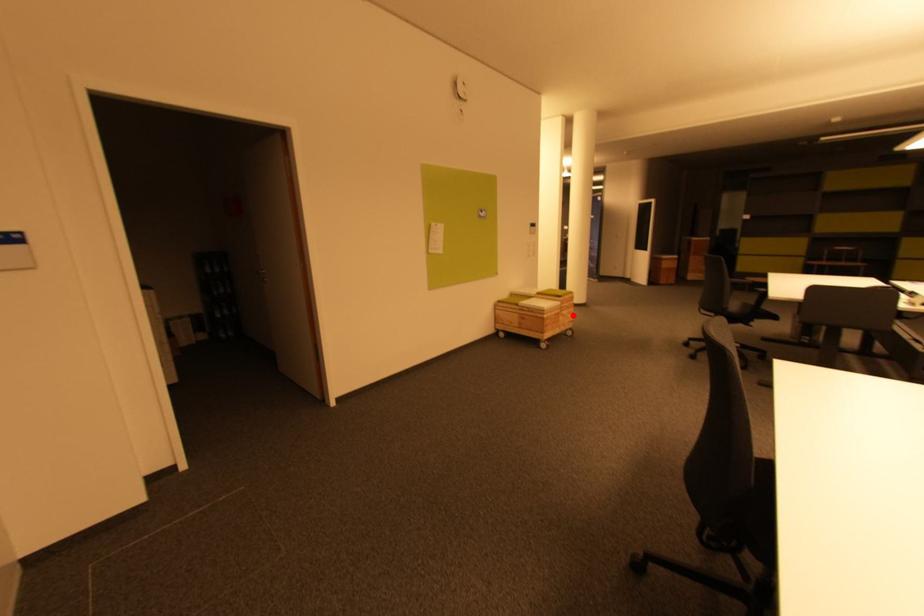
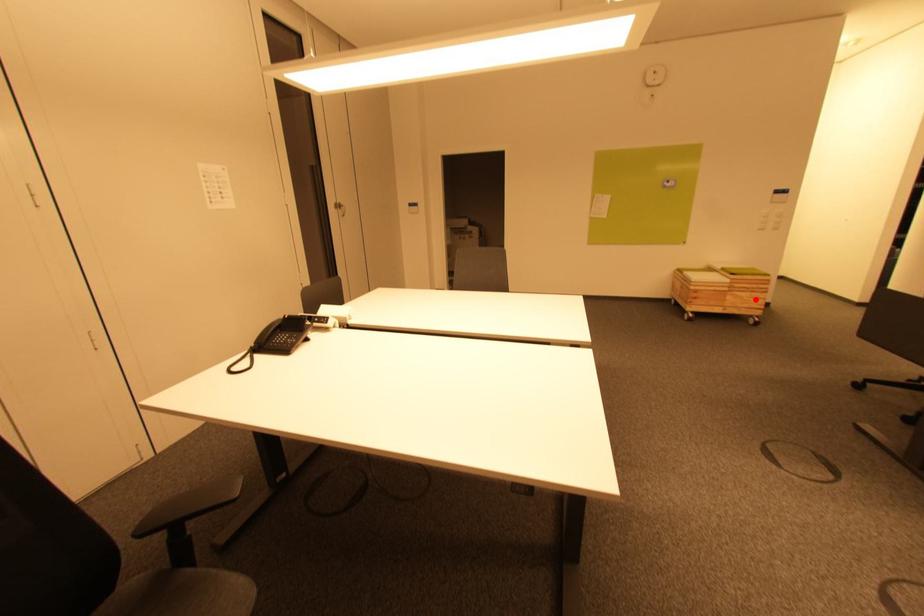
I am providing you with two images of the same scene from different viewpoints. A red point is marked on the first image and another point is marked on the second image. Does the point marked in image1 correspond to the same location as the one in image2?

Yes